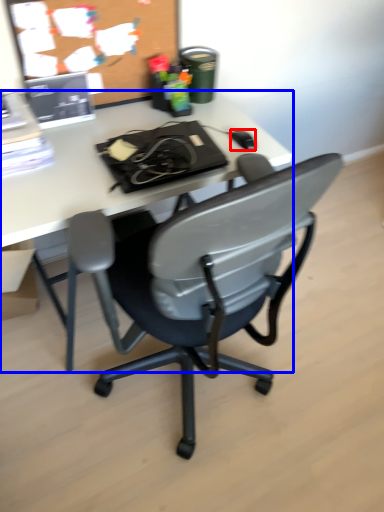
Question: Which object is closer to the camera taking this photo, mouse (highlighted by a red box) or desk (highlighted by a blue box)?

Choices:
 (A) mouse
 (B) desk

Answer: (B)